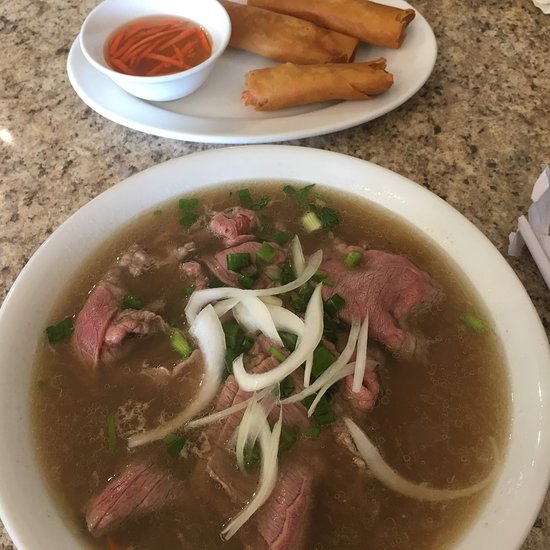
Locate an element on the screen. light grey and black granite table is located at coordinates (448, 153).